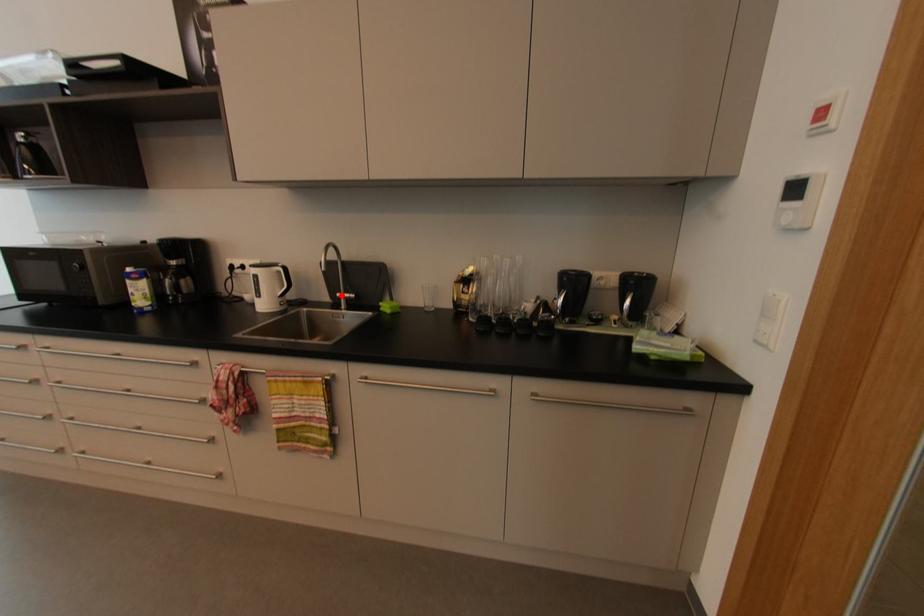
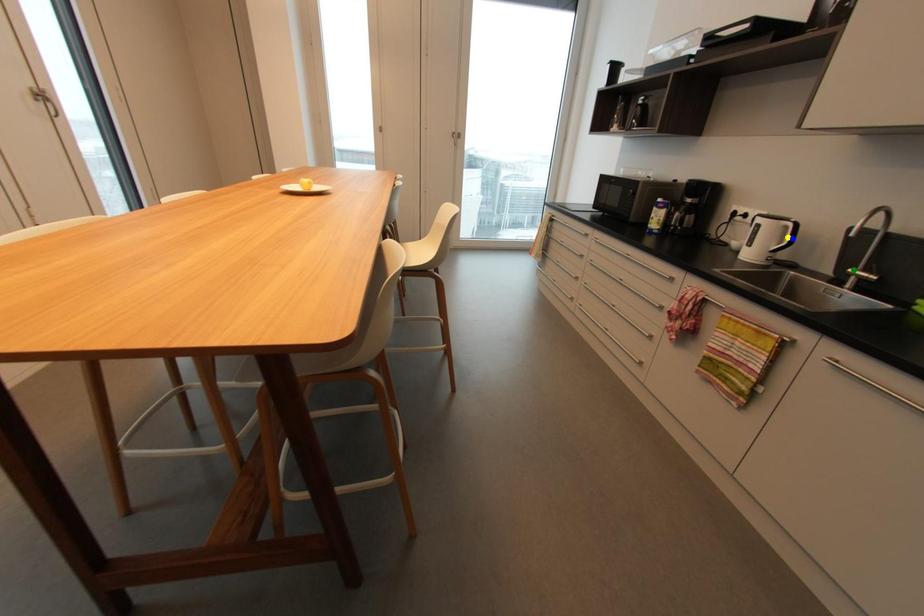
Question: I am providing you with two images of the same scene from different viewpoints. A red point is marked on the first image. You are given multiple points on the second image. Which mark in image 2 goes with the point in image 1?

Choices:
 (A) green point
 (B) yellow point
 (C) blue point

Answer: (A)